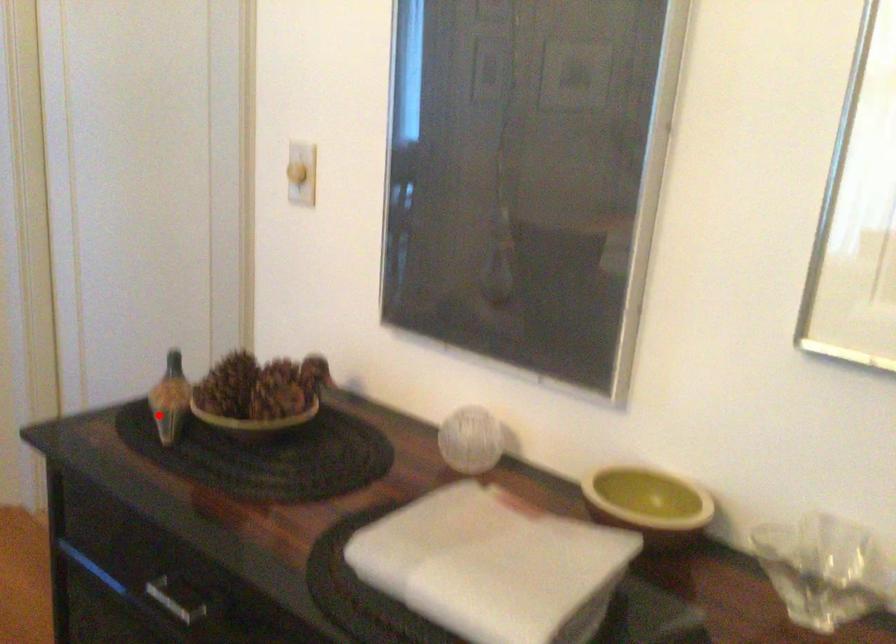
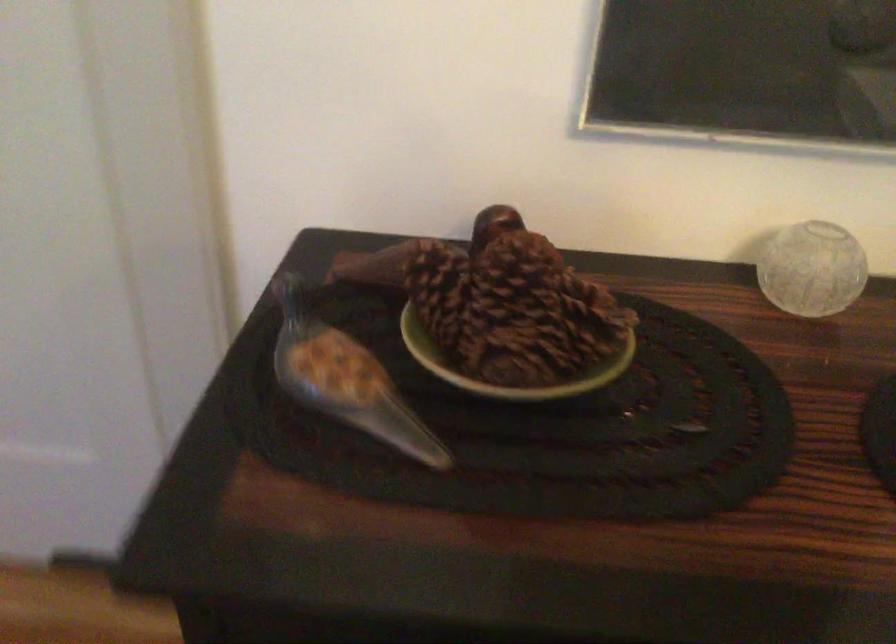
Find the pixel in the second image that matches the highlighted location in the first image.

(347, 386)